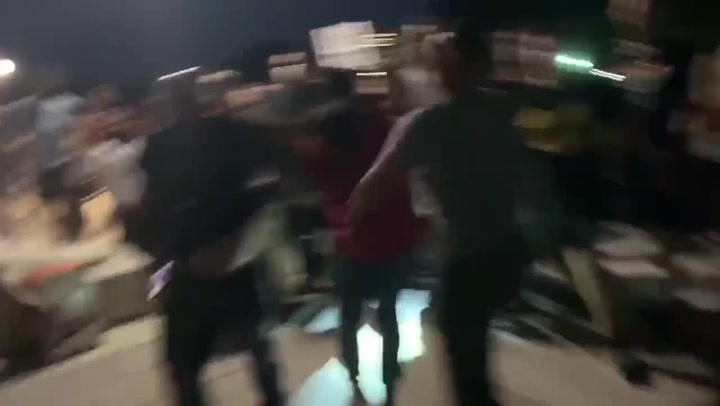
Find the location of `green light`. green light is located at coordinates point(570,64).